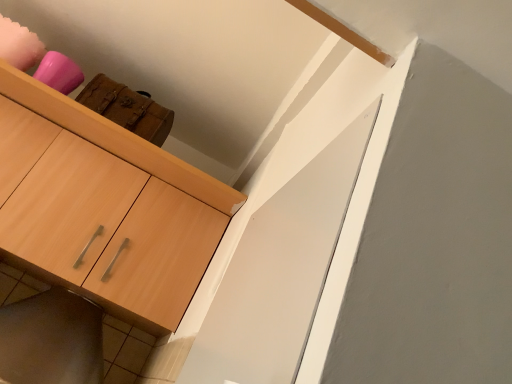
Question: Visually, is light wood cabinet at upper left positioned to the left or to the right of wooden cabinet at lower left?

Choices:
 (A) right
 (B) left

Answer: (B)

Question: From the image's perspective, is light wood cabinet at upper left positioned above or below wooden cabinet at lower left?

Choices:
 (A) above
 (B) below

Answer: (A)

Question: Is light wood cabinet at upper left situated inside wooden cabinet at lower left or outside?

Choices:
 (A) inside
 (B) outside

Answer: (B)

Question: Looking at their shapes, would you say wooden cabinet at lower left is wider or thinner than light wood cabinet at upper left?

Choices:
 (A) thin
 (B) wide

Answer: (A)

Question: From the image's perspective, is wooden cabinet at lower left positioned above or below light wood cabinet at upper left?

Choices:
 (A) below
 (B) above

Answer: (A)

Question: Is wooden cabinet at lower left spatially inside light wood cabinet at upper left, or outside of it?

Choices:
 (A) inside
 (B) outside

Answer: (A)

Question: Looking at the image, does wooden cabinet at lower left seem bigger or smaller compared to light wood cabinet at upper left?

Choices:
 (A) big
 (B) small

Answer: (B)